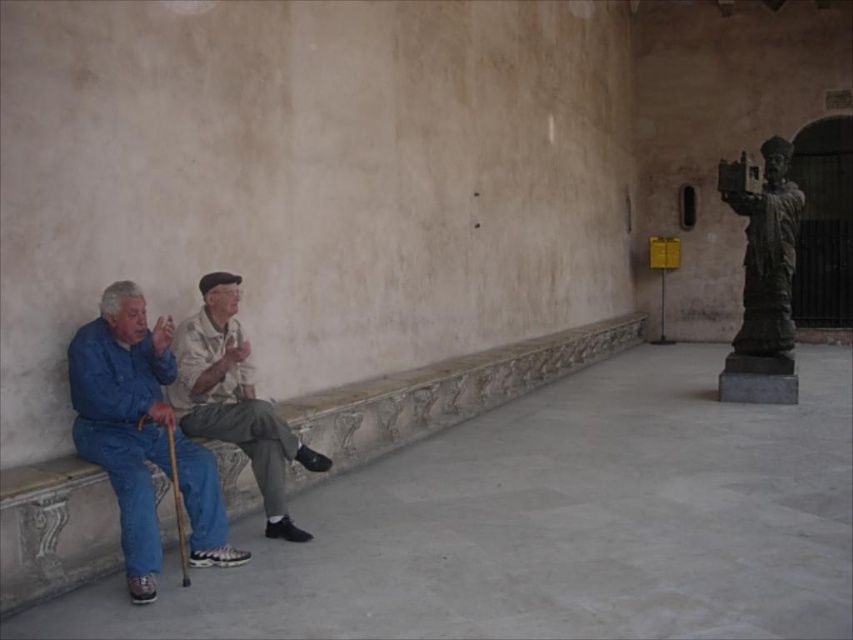
Question: Considering the real-world distances, which object is closest to the khaki fabric pants at center?

Choices:
 (A) blue denim jeans at left
 (B) bronze statue at right

Answer: (A)

Question: Which object is farther from the camera taking this photo?

Choices:
 (A) blue denim jeans at left
 (B) khaki fabric pants at center
 (C) bronze statue at right

Answer: (C)

Question: Can you confirm if blue denim jeans at left is wider than khaki fabric pants at center?

Choices:
 (A) yes
 (B) no

Answer: (B)

Question: Which object is the closest to the bronze statue at right?

Choices:
 (A) khaki fabric pants at center
 (B) blue denim jeans at left

Answer: (A)

Question: Is khaki fabric pants at center positioned behind bronze statue at right?

Choices:
 (A) yes
 (B) no

Answer: (B)

Question: Can you confirm if khaki fabric pants at center is positioned above bronze statue at right?

Choices:
 (A) no
 (B) yes

Answer: (A)